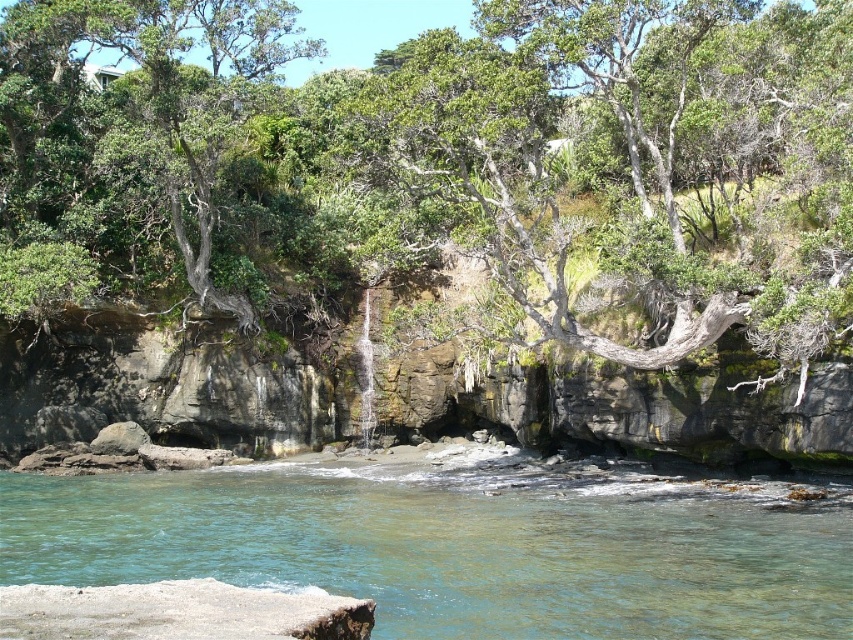
Does green leafy tree at center have a greater height compared to clear water at lower center?

Correct, green leafy tree at center is much taller as clear water at lower center.

Is green leafy tree at center to the right of clear water at lower center from the viewer's perspective?

Indeed, green leafy tree at center is positioned on the right side of clear water at lower center.

Is point (155, 132) positioned behind point (831, 616)?

Yes, it is.

Find the location of a particular element. This screenshot has height=640, width=853. green leafy tree at center is located at coordinates (469, 157).